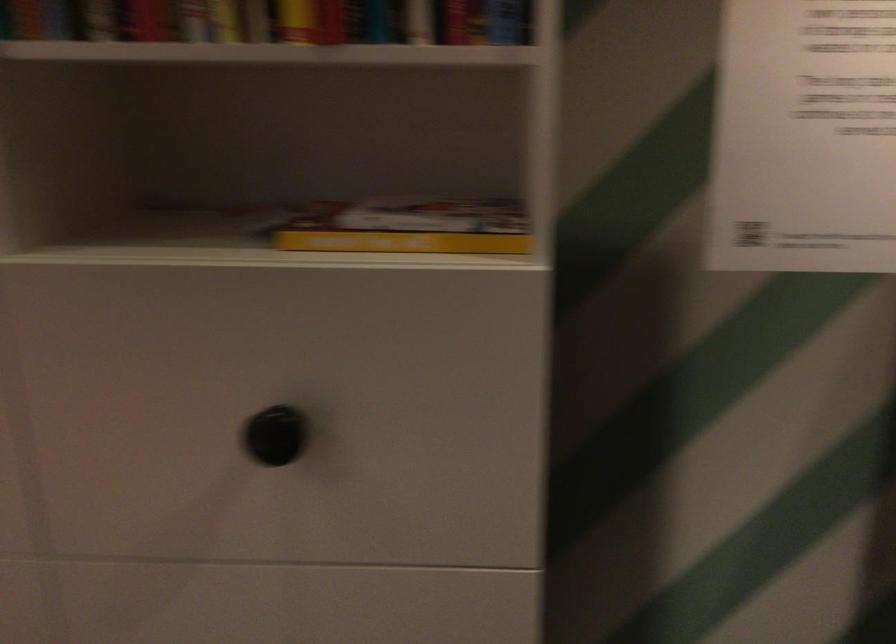
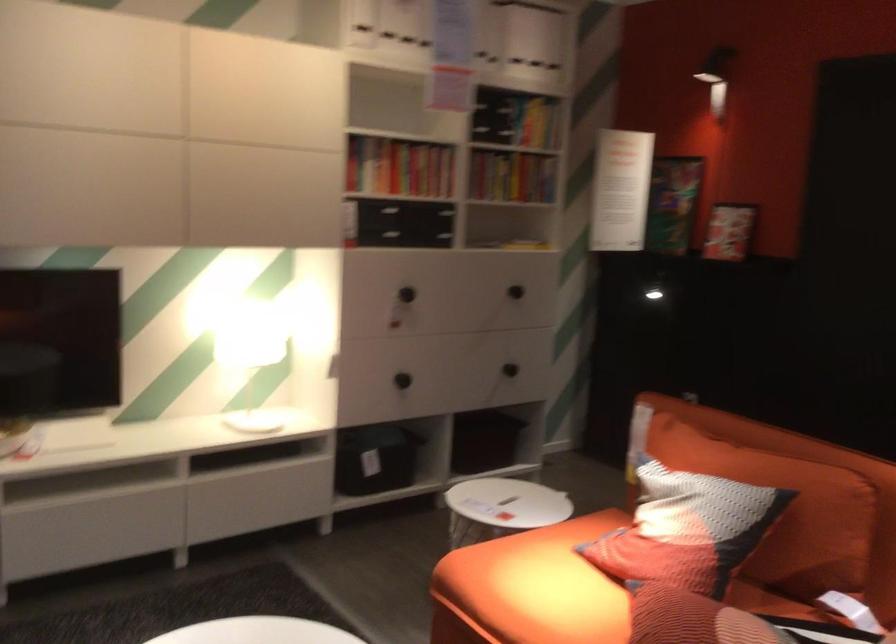
The point at (x=187, y=513) is marked in the first image. Where is the corresponding point in the second image?

(514, 292)